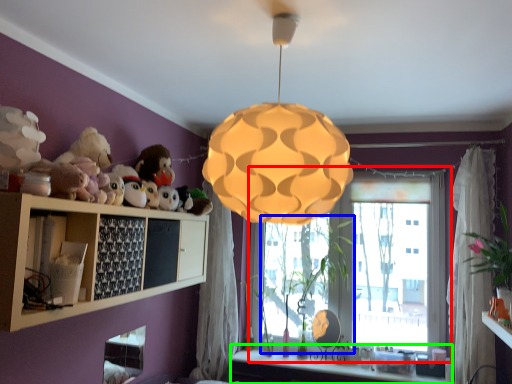
Question: Which object is positioned farthest from window (highlighted by a red box)? Select from plant (highlighted by a blue box) and vanity (highlighted by a green box).

Choices:
 (A) plant
 (B) vanity

Answer: (B)